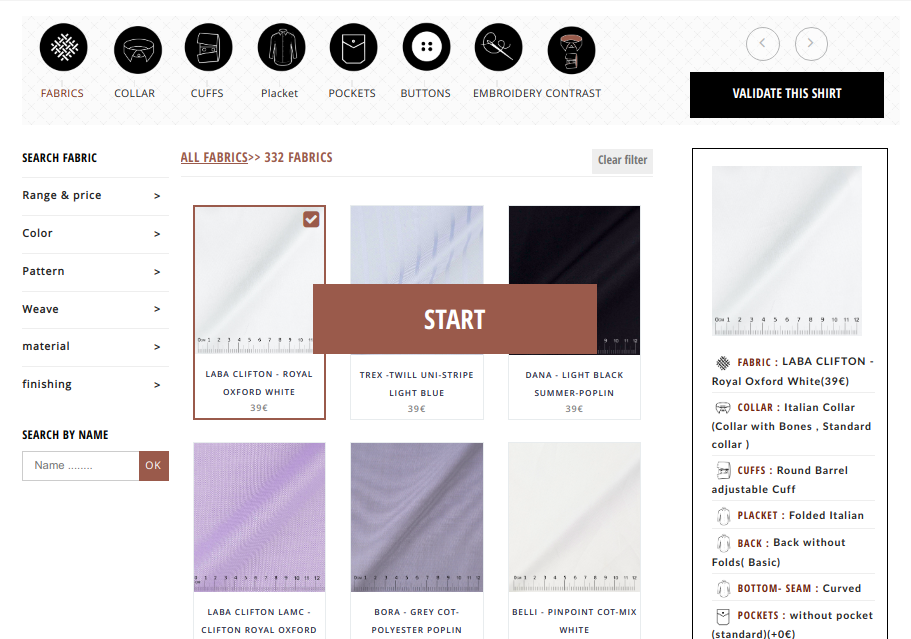
This screenshot has width=911, height=639. In order to click on images of fabrics in this screenshot , I will do pyautogui.click(x=251, y=507), pyautogui.click(x=232, y=304), pyautogui.click(x=420, y=241), pyautogui.click(x=422, y=491), pyautogui.click(x=612, y=516), pyautogui.click(x=584, y=250), pyautogui.click(x=813, y=243).